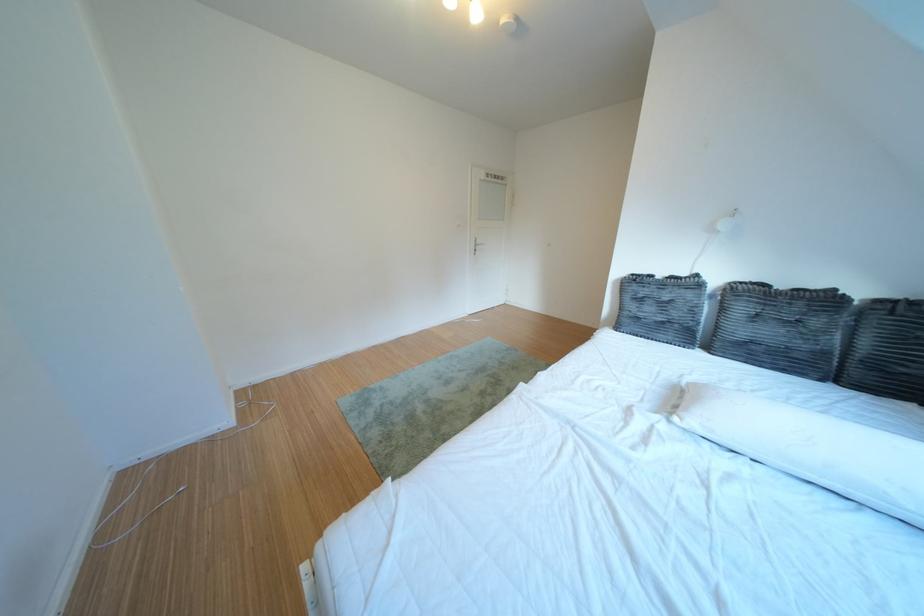
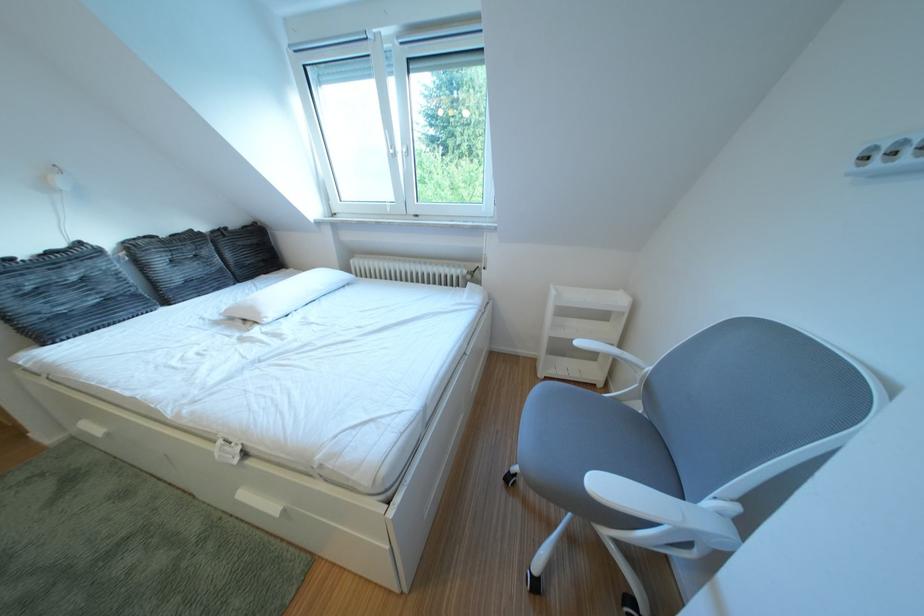
The point at (711, 281) is marked in the first image. Where is the corresponding point in the second image?

(93, 249)